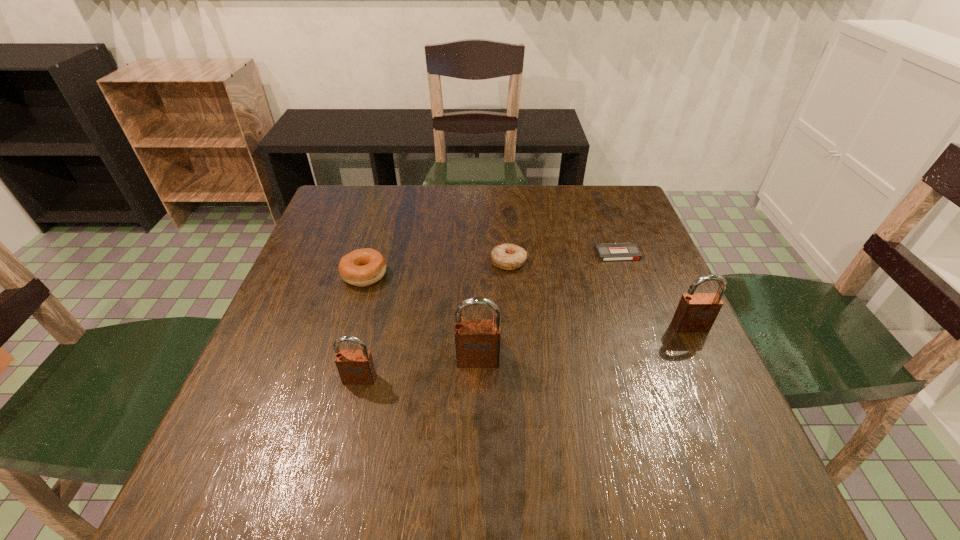
Please mark a free spot for a new padlock to balance the arrangement. Please provide its 2D coordinates. Your answer should be formatted as a tuple, i.e. [(x, y)], where the tuple contains the x and y coordinates of a point satisfying the conditions above.

[(588, 343)]